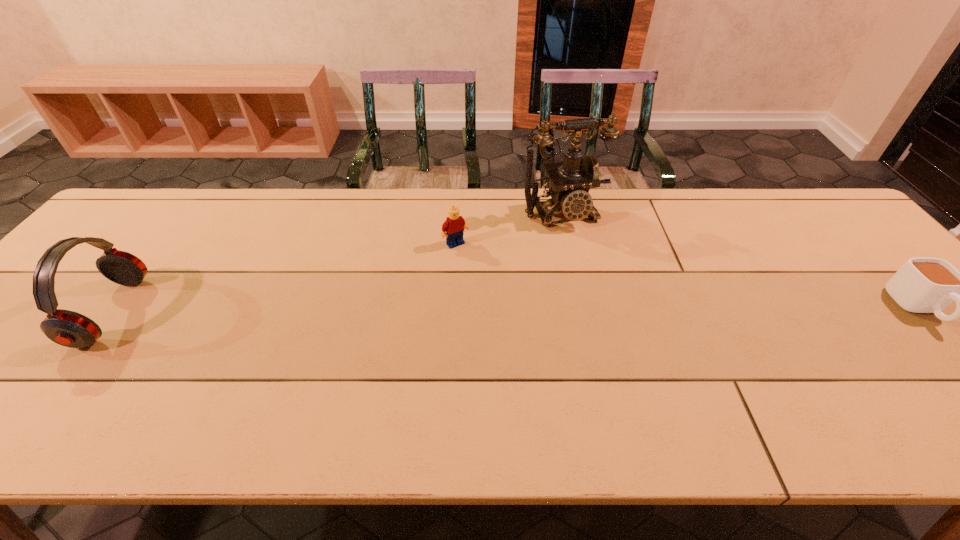
The height and width of the screenshot is (540, 960). I want to click on free spot located on the front-facing side of the Lego, so click(514, 313).

Locate an element on the screen. The image size is (960, 540). vacant space located on the rotary dial of the farthest object is located at coordinates (584, 250).

What are the coordinates of `free space located on the rotary dial of the farthest object` in the screenshot? It's located at (584, 250).

In order to click on vacant space situated on the rotary dial of the farthest object in this screenshot , I will do `click(580, 243)`.

Where is `object that is positioned at the far edge`? This screenshot has width=960, height=540. object that is positioned at the far edge is located at coordinates (570, 181).

The height and width of the screenshot is (540, 960). I want to click on object present at the left edge, so click(x=67, y=328).

This screenshot has width=960, height=540. In the image, there is a desktop. Find the location of `free region at the far edge`. free region at the far edge is located at coordinates (582, 224).

What are the coordinates of `vacant space at the near edge` in the screenshot? It's located at (636, 386).

This screenshot has width=960, height=540. I want to click on vacant space at the left edge of the desktop, so click(x=93, y=270).

Locate an element on the screen. This screenshot has height=540, width=960. vacant point at the far left corner is located at coordinates (127, 231).